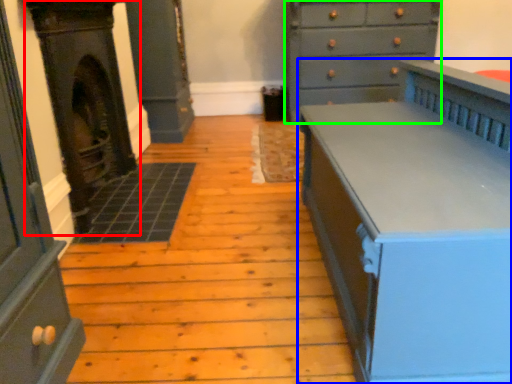
Question: Which object is positioned farthest from fireplace (highlighted by a red box)? Select from chest of drawers (highlighted by a blue box) and chest of drawers (highlighted by a green box).

Choices:
 (A) chest of drawers
 (B) chest of drawers

Answer: (B)